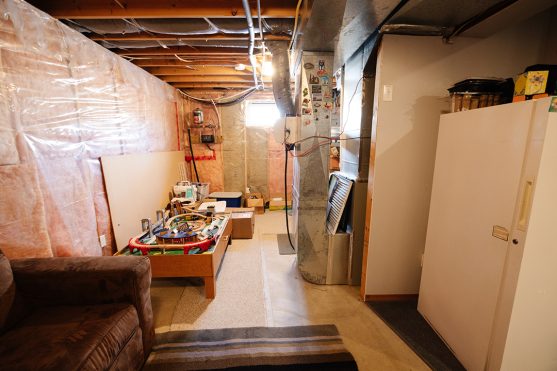
Where is `place to sit`? The image size is (557, 371). place to sit is located at coordinates (95, 322).